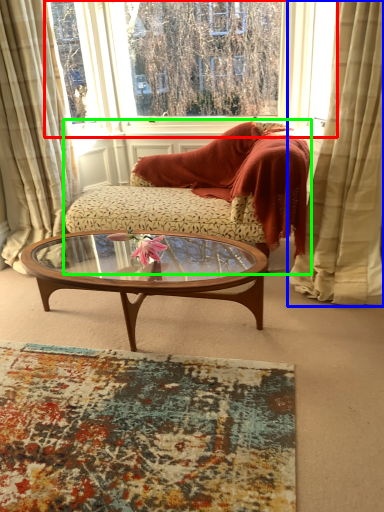
Question: Which object is the closest to the window (highlighted by a red box)? Choose among these: curtain (highlighted by a blue box) or studio couch (highlighted by a green box).

Choices:
 (A) curtain
 (B) studio couch

Answer: (B)